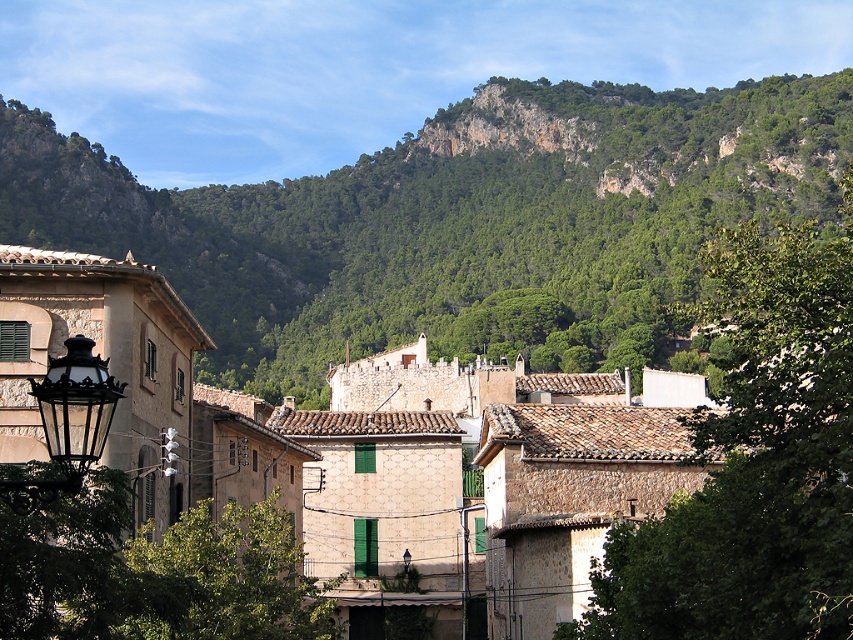
You are standing in the village square and want to take a photo of both the point at coordinates (729, 134) and the point at coordinates (833, 280). Which point should you focus on first to ensure both are in sharp focus?

You should focus on the point at coordinates (729, 134) first because it is closer to the camera than the point at coordinates (833, 280). This ensures that both points will be in focus when using the camera.

You are an architect planning to install a new streetlight in the village. You need to ensure it doesn not block the view of the green leafy mountain at upper center and green leafy tree at upper center. Which object should you consider the width of when deciding placement?

The green leafy mountain at upper center has a greater width than the green leafy tree at upper center, so you should consider the width of the green leafy mountain at upper center to ensure the new streetlight does not block its view.